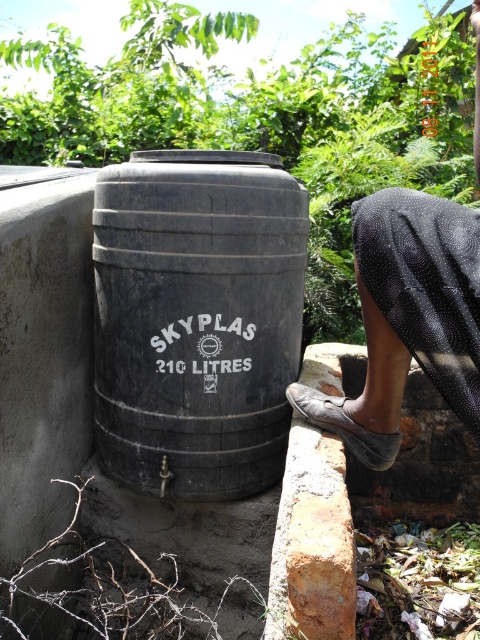
Is black matte barrel at center below black mesh cloth at upper right?

Indeed, black matte barrel at center is positioned under black mesh cloth at upper right.

Which of these two, black matte barrel at center or black mesh cloth at upper right, stands shorter?

black mesh cloth at upper right is shorter.

This screenshot has height=640, width=480. In order to click on black matte barrel at center in this screenshot , I will do `click(196, 320)`.